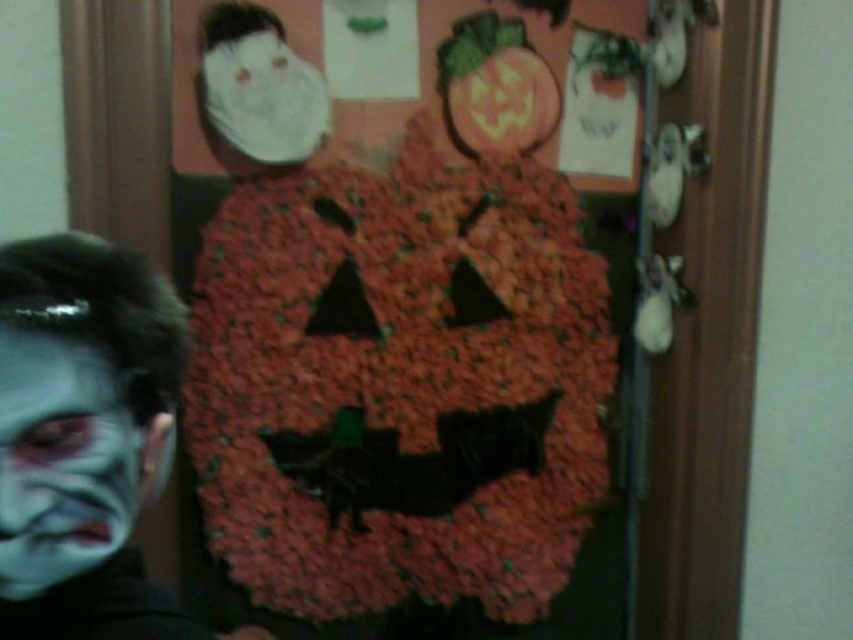
Question: Estimate the real-world distances between objects in this image. Which object is farther from the white matte face paint at lower left?

Choices:
 (A) matte orange pumpkin at upper center
 (B) fluffy red pumpkin at center

Answer: (A)

Question: Considering the real-world distances, which object is closest to the white matte face paint at lower left?

Choices:
 (A) matte orange pumpkin at upper center
 (B) fluffy red pumpkin at center

Answer: (B)

Question: Does white matte face at lower left have a smaller size compared to matte orange pumpkin at upper center?

Choices:
 (A) yes
 (B) no

Answer: (A)

Question: Based on their relative distances, which object is farther from the fluffy red pumpkin at center?

Choices:
 (A) white matte face at lower left
 (B) white matte face paint at lower left

Answer: (A)

Question: Does fluffy red pumpkin at center appear on the right side of white matte face at lower left?

Choices:
 (A) no
 (B) yes

Answer: (B)

Question: Does white matte face paint at lower left lie behind matte orange pumpkin at upper center?

Choices:
 (A) no
 (B) yes

Answer: (A)